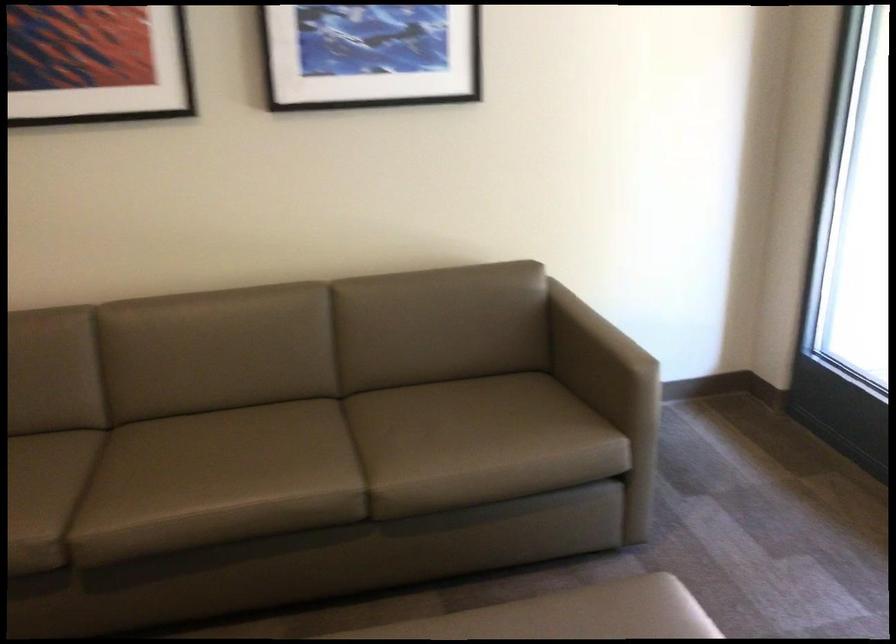
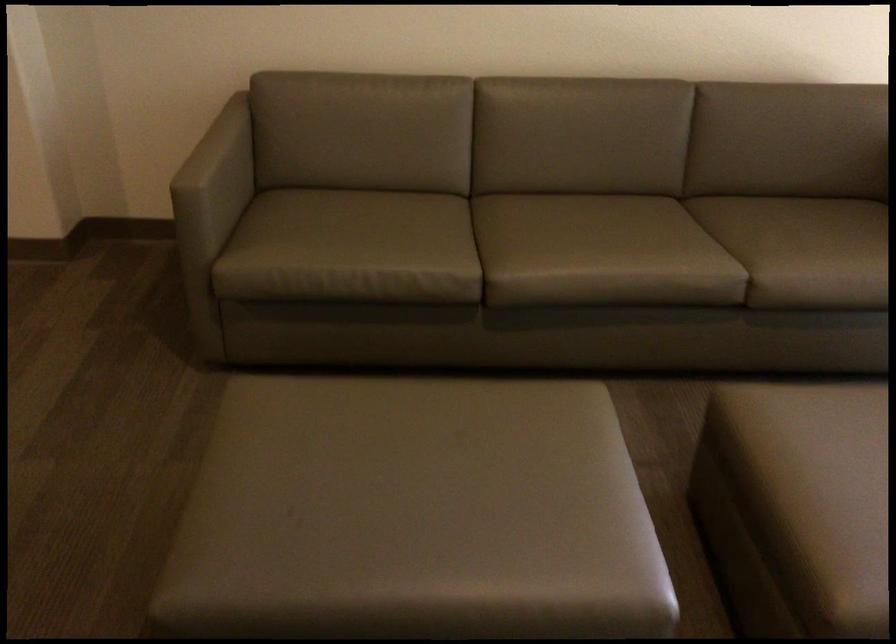
In the second image, find the point that corresponds to (195,486) in the first image.

(583, 247)